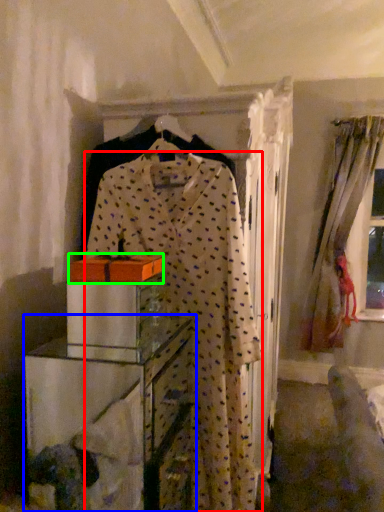
Question: Which object is the farthest from fancy dress (highlighted by a red box)? Choose among these: furniture (highlighted by a blue box) or cardboard box (highlighted by a green box).

Choices:
 (A) furniture
 (B) cardboard box

Answer: (A)